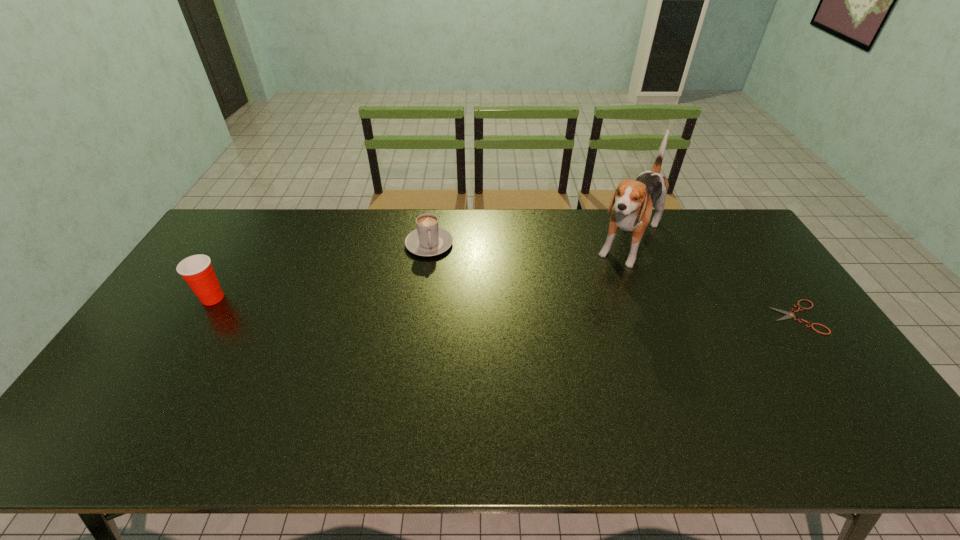
Find the location of `free space on the desktop that is between the Dixie cup and the shortest object and is positioned to the right of the second shortest object`. free space on the desktop that is between the Dixie cup and the shortest object and is positioned to the right of the second shortest object is located at coordinates (442, 306).

Find the location of a particular element. This screenshot has width=960, height=540. free space on the desktop that is between the Dixie cup and the shears and is positioned at the face of the second object from right to left is located at coordinates click(586, 310).